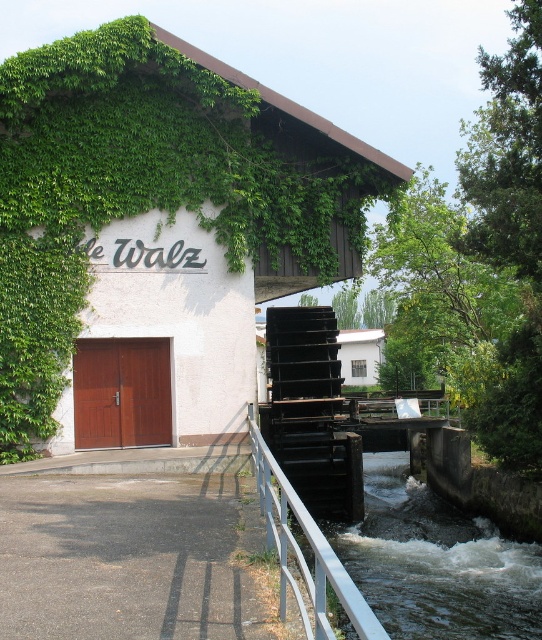
Consider the image. Who is positioned more to the left, green ivy at upper left or silver metallic rail at lower center?

green ivy at upper left

Can you confirm if green ivy at upper left is wider than silver metallic rail at lower center?

Indeed, green ivy at upper left has a greater width compared to silver metallic rail at lower center.

Who is more distant from viewer, (x=212, y=296) or (x=264, y=518)?

The point (x=212, y=296) is more distant.

Find the location of a particular element. green ivy at upper left is located at coordinates (157, 236).